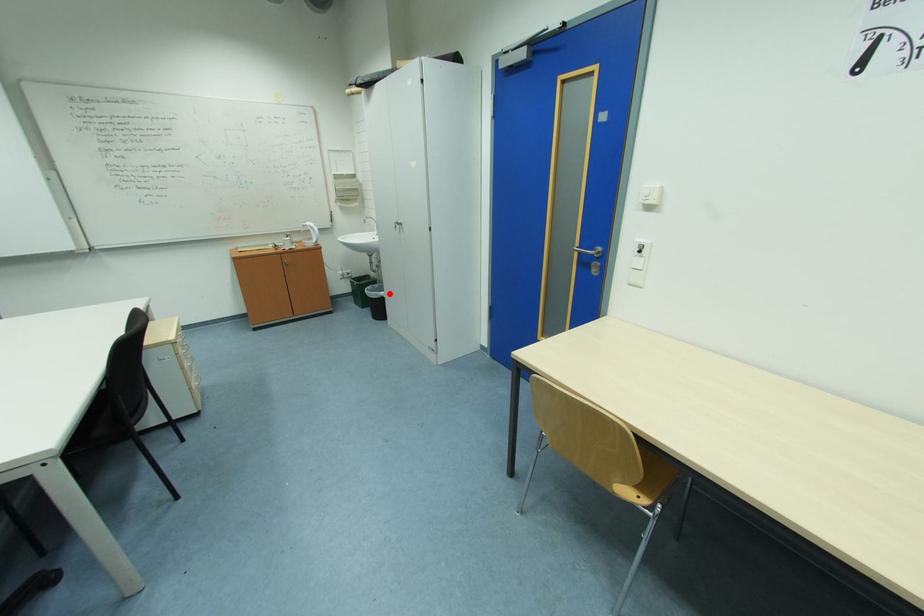
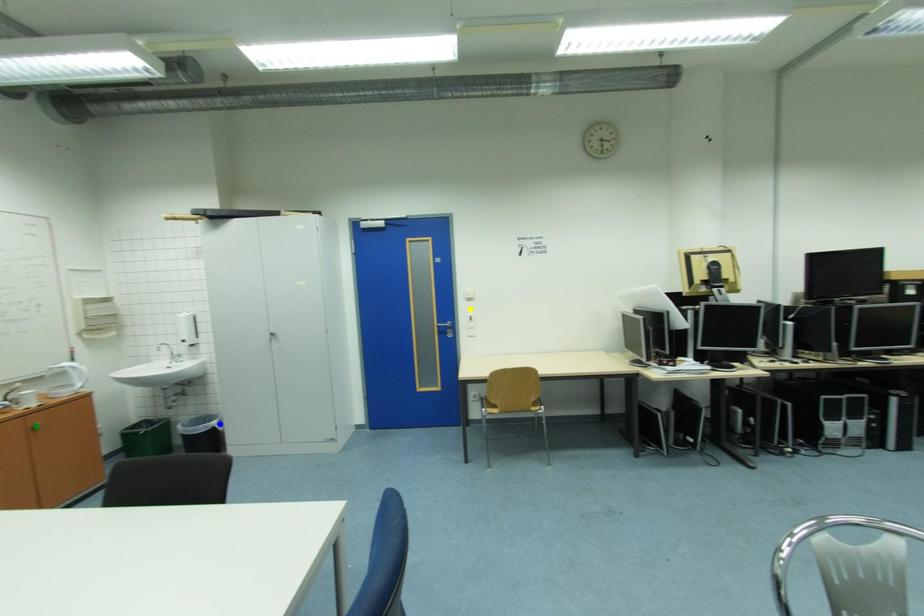
Question: I am providing you with two images of the same scene from different viewpoints. A red point is marked on the first image. You are given multiple points on the second image. Which point in image 2 is actually the same real-world point as the red point in image 1?

Choices:
 (A) yellow point
 (B) blue point
 (C) green point

Answer: (B)